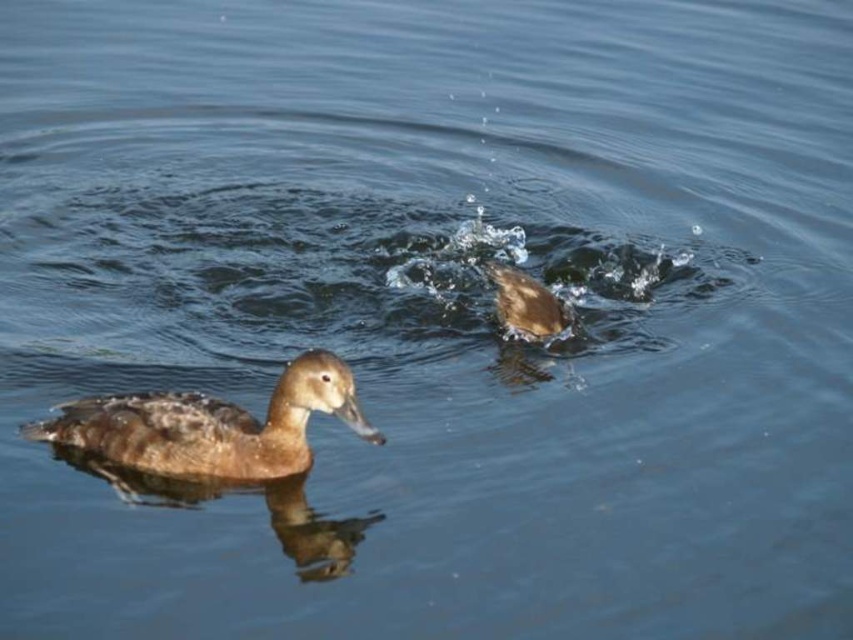
Which is below, brown fuzzy duck at lower left or brown fuzzy duck at center?

Positioned lower is brown fuzzy duck at lower left.

Is brown fuzzy duck at lower left below brown fuzzy duck at center?

Yes.

Who is more distant from viewer, (274, 401) or (515, 294)?

The point (515, 294) is more distant.

You are a GUI agent. You are given a task and a screenshot of the screen. Output one action in this format:
    pyautogui.click(x=<x>, y=<y>)
    Task: Click on the brown fuzzy duck at lower left
    
    Given the screenshot: What is the action you would take?
    pyautogui.click(x=212, y=426)